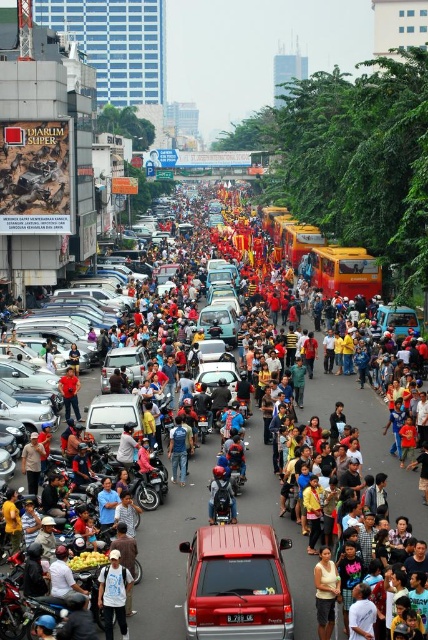
The height and width of the screenshot is (640, 428). What are the coordinates of `yellow fabric shirt at center` in the screenshot? It's located at (219, 572).

Does yellow fabric shirt at center appear on the right side of blue jeans at center?

Correct, you'll find yellow fabric shirt at center to the right of blue jeans at center.

Find the location of a particular element. This screenshot has width=428, height=640. yellow fabric shirt at center is located at coordinates (219, 572).

Which is above, metallic red van at center or shiny black motorcycle at center?

Positioned higher is shiny black motorcycle at center.

Which is in front, point (240, 600) or point (219, 480)?

Point (240, 600)

Where is `metallic red van at center`? metallic red van at center is located at coordinates (237, 582).

Can you confirm if metallic red van at center is positioned above silver metallic van at center?

No, metallic red van at center is not above silver metallic van at center.

Does metallic red van at center have a lesser width compared to silver metallic van at center?

No.

What do you see at coordinates (237, 582) in the screenshot?
I see `metallic red van at center` at bounding box center [237, 582].

This screenshot has width=428, height=640. What are the coordinates of `metallic red van at center` in the screenshot? It's located at (237, 582).